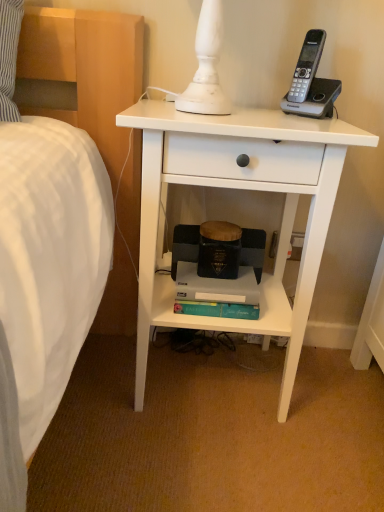
Question: Is white matte nightstand at center in front of or behind teal matte paperback book at lower center in the image?

Choices:
 (A) front
 (B) behind

Answer: (A)

Question: Is white matte nightstand at center to the left or to the right of teal matte paperback book at lower center in the image?

Choices:
 (A) right
 (B) left

Answer: (A)

Question: From the image's perspective, relative to teal matte paperback book at lower center, is white matte nightstand at center above or below?

Choices:
 (A) above
 (B) below

Answer: (A)

Question: From the image's perspective, is teal matte paperback book at lower center located above or below white matte nightstand at center?

Choices:
 (A) above
 (B) below

Answer: (B)

Question: Considering the positions of point (240, 284) and point (304, 120), is point (240, 284) closer or farther from the camera than point (304, 120)?

Choices:
 (A) farther
 (B) closer

Answer: (A)

Question: From a real-world perspective, relative to white matte nightstand at center, is teal matte paperback book at lower center vertically above or below?

Choices:
 (A) above
 (B) below

Answer: (B)

Question: Is teal matte paperback book at lower center situated inside white matte nightstand at center or outside?

Choices:
 (A) inside
 (B) outside

Answer: (A)